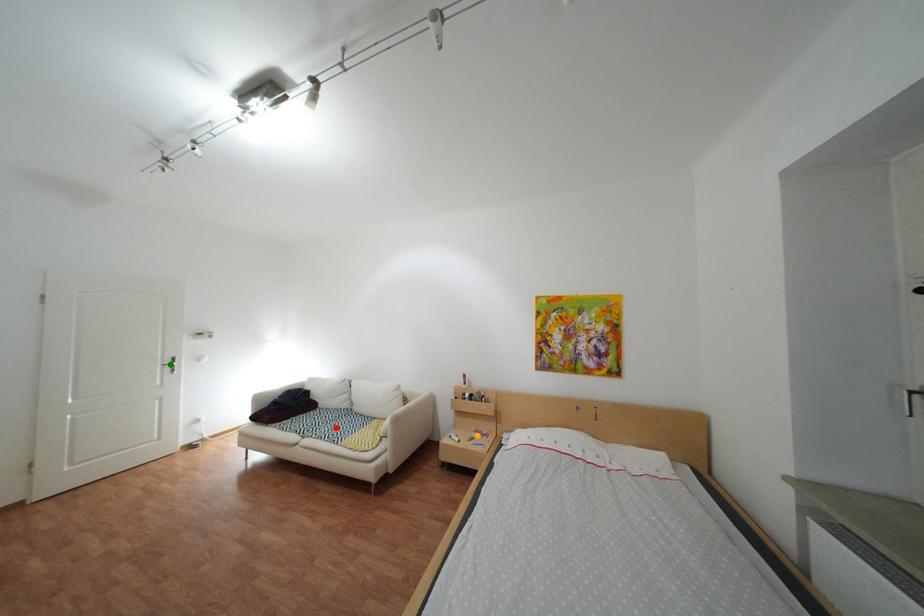
Order these from nearest to farthest:
- green point
- orange point
- red point

1. red point
2. green point
3. orange point